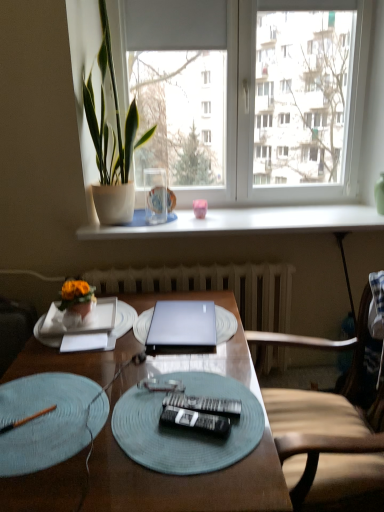
Locate an element on the screen. The image size is (384, 512). free space to the back side of black plastic remote control at center, which ranks as the second remote control in front-to-back order is located at coordinates (199, 375).